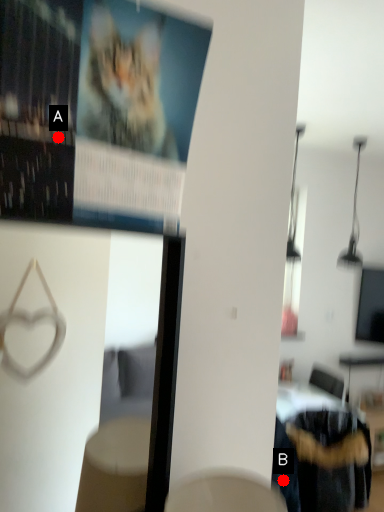
Question: Two points are circled on the image, labeled by A and B beside each circle. Among these points, which one is nearest to the camera?

Choices:
 (A) A is closer
 (B) B is closer

Answer: (A)